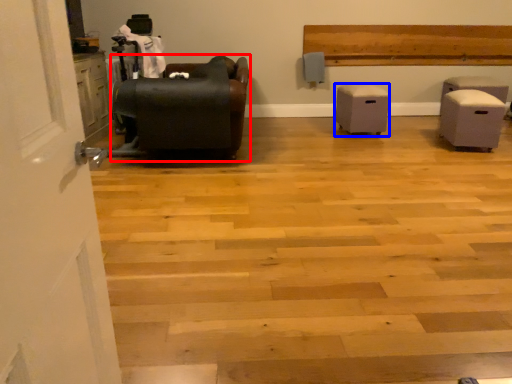
Question: Which object appears closest to the camera in this image, furniture (highlighted by a red box) or furniture (highlighted by a blue box)?

Choices:
 (A) furniture
 (B) furniture

Answer: (A)